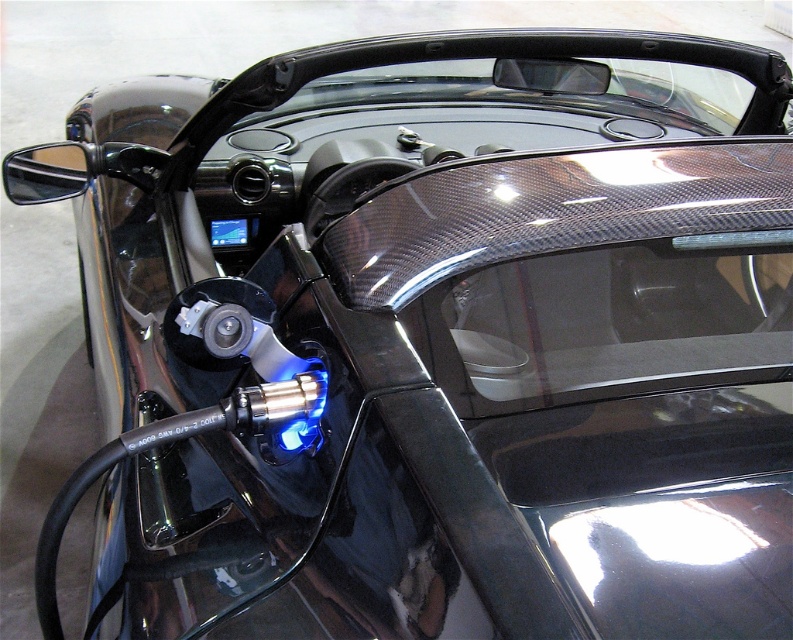
You are a car designer evaluating the front left side of a sleek black sports car. You notice two transparent carbon fiber windshields labeled as transparent carbon fiber windshield at center and transparent carbon fiber windshield at upper center. Which of these two windshields is shorter in height?

The transparent carbon fiber windshield at center has a lesser height compared to the transparent carbon fiber windshield at upper center, so the windshield at center is shorter in height.

What is the 2D coordinate of the transparent carbon fiber windshield at center?

The transparent carbon fiber windshield at center is located at the 2D coordinate point of (x=606, y=321).

You are a delivery person trying to see through the transparent carbon fiber windshield at center and the transparent carbon fiber windshield at upper center to check if the sports car is occupied. Which windshield should you look through to see the driver seat area?

You should look through the transparent carbon fiber windshield at upper center because it is positioned above the transparent carbon fiber windshield at center, offering a better view of the driver seat area.